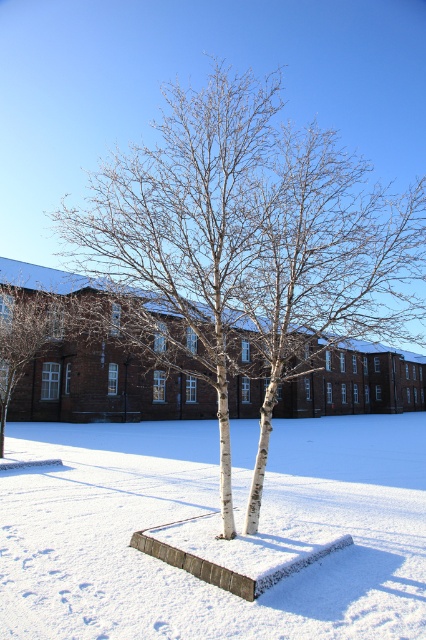
Who is shorter, white bark tree at center or white powdery snow at center?

white powdery snow at center

Who is more forward, (100, 168) or (261, 625)?

Point (261, 625) is more forward.

The image size is (426, 640). Find the location of `white bark tree at center`. white bark tree at center is located at coordinates (247, 248).